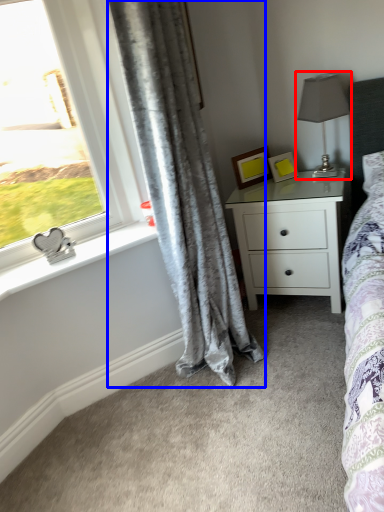
Question: Which object appears farthest to the camera in this image, table lamp (highlighted by a red box) or curtain (highlighted by a blue box)?

Choices:
 (A) table lamp
 (B) curtain

Answer: (A)